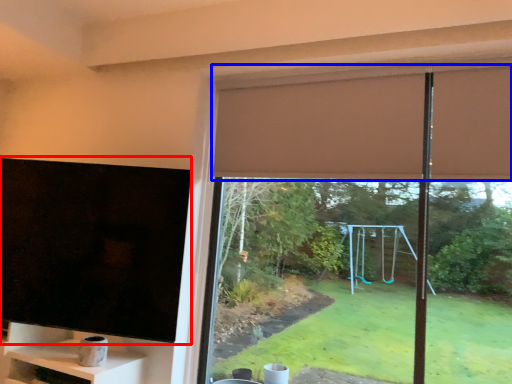
Question: Which object appears closest to the camera in this image, window screen (highlighted by a red box) or curtain (highlighted by a blue box)?

Choices:
 (A) window screen
 (B) curtain

Answer: (A)